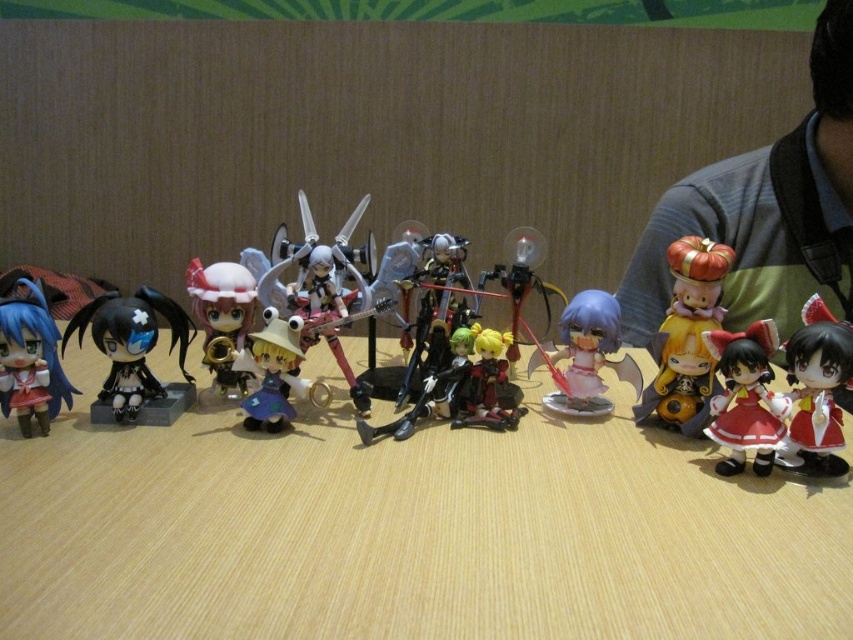
You are organizing a display and need to place the wooden table at center and the matte red dress at lower right. Since you want to ensure the dress is visible, which object should be placed closer to the front?

The matte red dress at lower right should be placed closer to the front because it is shorter than the wooden table at center, allowing it to be seen over the taller table.

You are organizing a display of figurines on a shelf. You have a small decorative item that needs to be placed near the point at coordinates point (x=51, y=317). According to the scene description, where exactly should you place this item?

The point (x=51, y=317) is located on the matte plastic figurines at center, so you should place the decorative item near the matte plastic figurines at center.